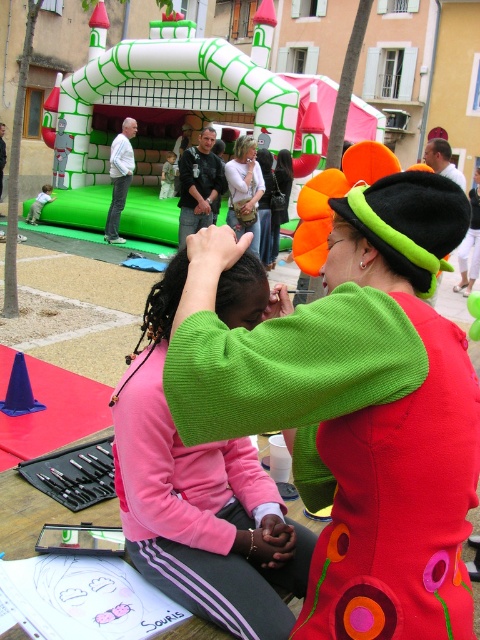
Question: Estimate the real-world distances between objects in this image. Which object is closer to the matte black hair at center?

Choices:
 (A) fluorescent green felt hat at center
 (B) pink fleece jacket at center
 (C) matte pink hoodie at center

Answer: (C)

Question: Can you confirm if pink fleece jacket at center is positioned above matte pink hoodie at center?

Choices:
 (A) no
 (B) yes

Answer: (A)

Question: Can you confirm if fluorescent green felt hat at center is positioned above matte pink hoodie at center?

Choices:
 (A) no
 (B) yes

Answer: (A)

Question: Which of the following is the farthest from the observer?

Choices:
 (A) (236, 161)
 (B) (282, 214)

Answer: (B)

Question: Which point is farther to the camera?

Choices:
 (A) matte black hair at center
 (B) fluorescent green felt hat at center
 (C) matte pink hoodie at center

Answer: (A)

Question: Can you confirm if fluorescent green felt hat at center is smaller than matte pink hoodie at center?

Choices:
 (A) yes
 (B) no

Answer: (A)